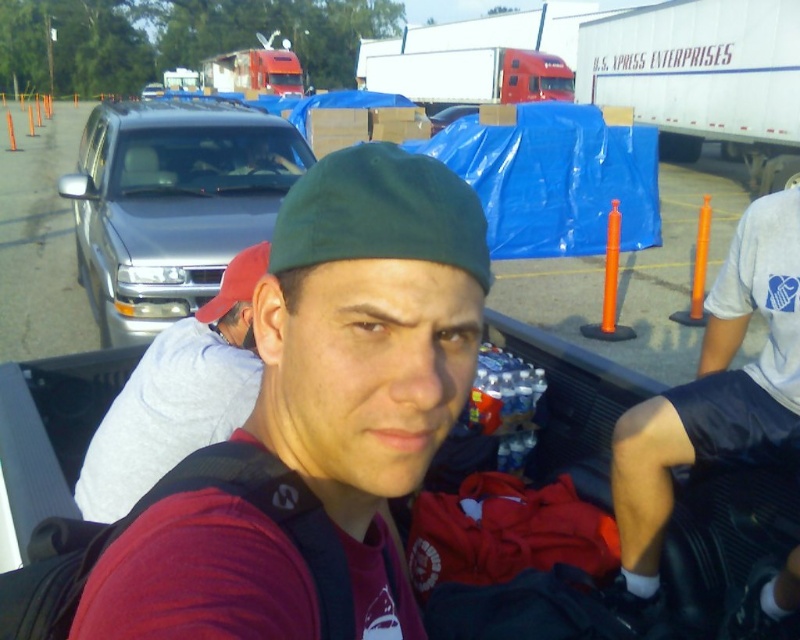
Describe the element at coordinates (368, 346) in the screenshot. This screenshot has width=800, height=640. I see `matte red shirt at center` at that location.

Measure the distance between matte red shirt at center and camera.

matte red shirt at center and camera are 20.42 inches apart from each other.

Where is `matte red shirt at center`? The image size is (800, 640). matte red shirt at center is located at coordinates (368, 346).

Between point (152, 442) and point (262, 154), which one is positioned behind?

Positioned behind is point (262, 154).

Is gray cotton shirt at left wider than matte black truck driver at upper center?

No, gray cotton shirt at left is not wider than matte black truck driver at upper center.

Does point (225, 275) lie in front of point (232, 140)?

Yes, point (225, 275) is closer to viewer.

Identify the location of gray cotton shirt at left. The image size is (800, 640). (178, 396).

Measure the distance from matte red shirt at center to red fabric cap at center.

A distance of 38.10 inches exists between matte red shirt at center and red fabric cap at center.

Is matte red shirt at center smaller than red fabric cap at center?

Actually, matte red shirt at center might be larger than red fabric cap at center.

Does point (226, 618) lie in front of point (240, 298)?

Yes.

Where is `matte red shirt at center`? The image size is (800, 640). matte red shirt at center is located at coordinates (368, 346).